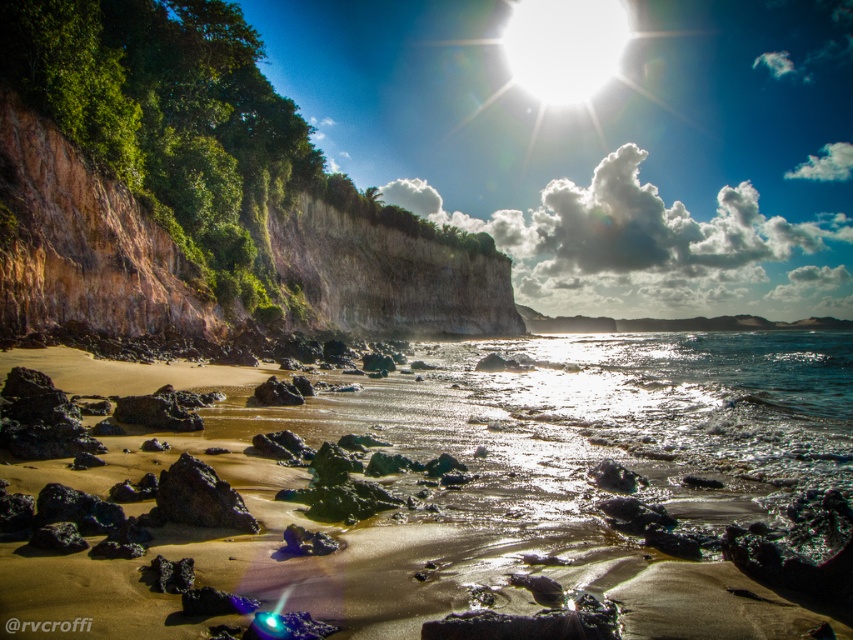
You are standing at the point labeled as point (390, 529). What is the name of the location you are currently standing on?

You are standing on the sandy beach at center as indicated by point (390, 529).

Based on the photo, you are a hiker who has just arrived at the sandy beach at center. You want to reach the rustic stone cliff at left to explore its caves. Given that your average walking speed is 3 feet per second, how long will it take you to reach the cliff from the beach?

The distance between the sandy beach at center and the rustic stone cliff at left is 99.91 feet. At a walking speed of 3 feet per second, dividing the distance by the speed gives approximately 33.3 seconds. Therefore, it will take roughly 33 seconds to reach the cliff.

You are planning to build a small sandcastle on the sandy beach at center. Since the rough volcanic rock at center is nearby, will you have enough space to build it without the rock getting in the way?

The sandy beach at center is larger in size than the rough volcanic rock at center, so there is sufficient space to build the sandcastle without the rock interfering.